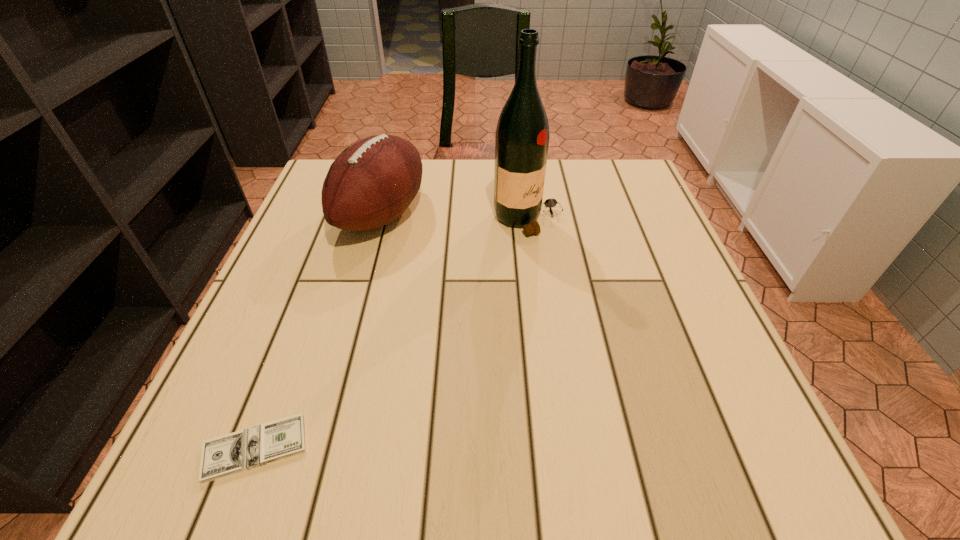
I want to click on the tallest object, so click(x=522, y=135).

Find the location of a particular element. the rightmost object is located at coordinates (522, 135).

Locate an element on the screen. Image resolution: width=960 pixels, height=540 pixels. football (American) is located at coordinates (371, 183).

The width and height of the screenshot is (960, 540). What are the coordinates of `the shortest object` in the screenshot? It's located at (229, 454).

Where is `dollar`? This screenshot has height=540, width=960. dollar is located at coordinates (229, 454).

Identify the location of free location located 0.090m on the front of the wine bottle. (535, 266).

Identify the location of free space located on the left of the football (American). (306, 215).

At what (x,y) coordinates should I click in order to perform the action: click on vacant area situated 0.280m on the right of the dollar. Please return your answer as a coordinate pair (x, y). Image resolution: width=960 pixels, height=540 pixels. Looking at the image, I should click on (495, 448).

Locate an element on the screen. wine bottle at the far edge is located at coordinates (522, 135).

Where is `football (American) that is positioned at the far edge`? Image resolution: width=960 pixels, height=540 pixels. football (American) that is positioned at the far edge is located at coordinates (371, 183).